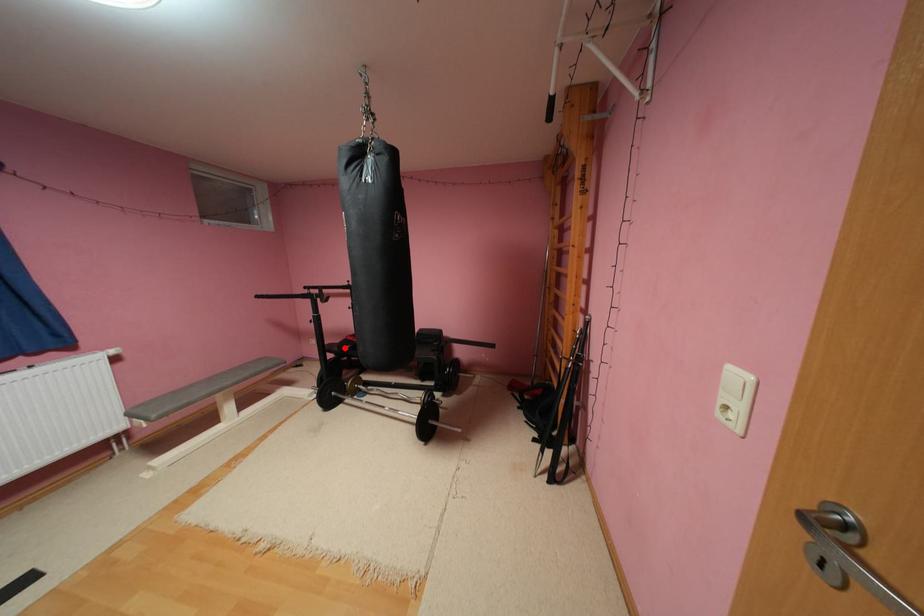
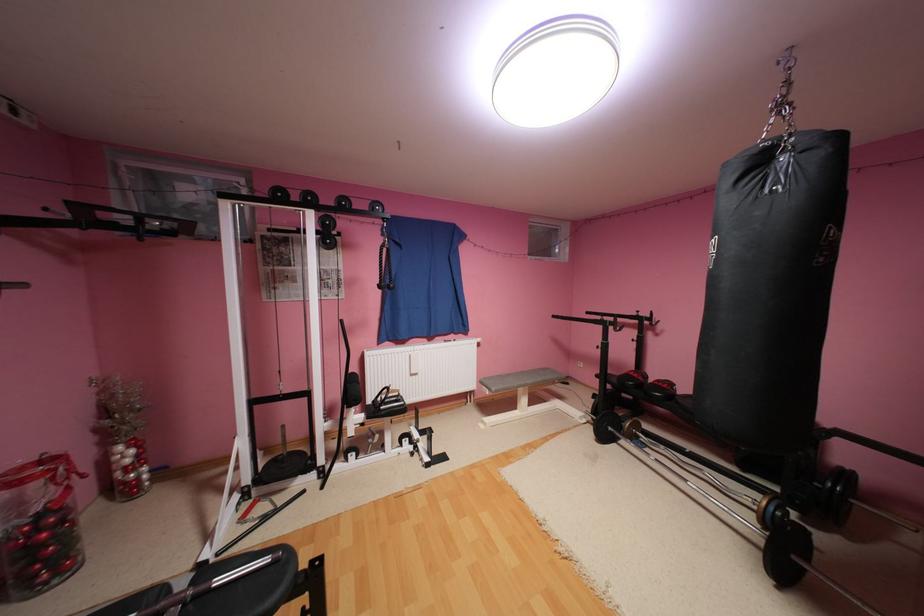
Question: I am providing you with two images of the same scene from different viewpoints. In image1, a red point is highlighted. Considering the same 3D point in image2, which of the following is correct?

Choices:
 (A) It is closer
 (B) It is farther

Answer: (A)